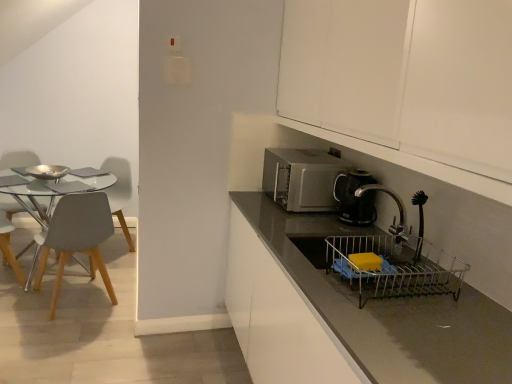
Identify the location of unoccupied region to the right of light gray plastic chair at left, the 4th chair from the left. The width and height of the screenshot is (512, 384). (121, 312).